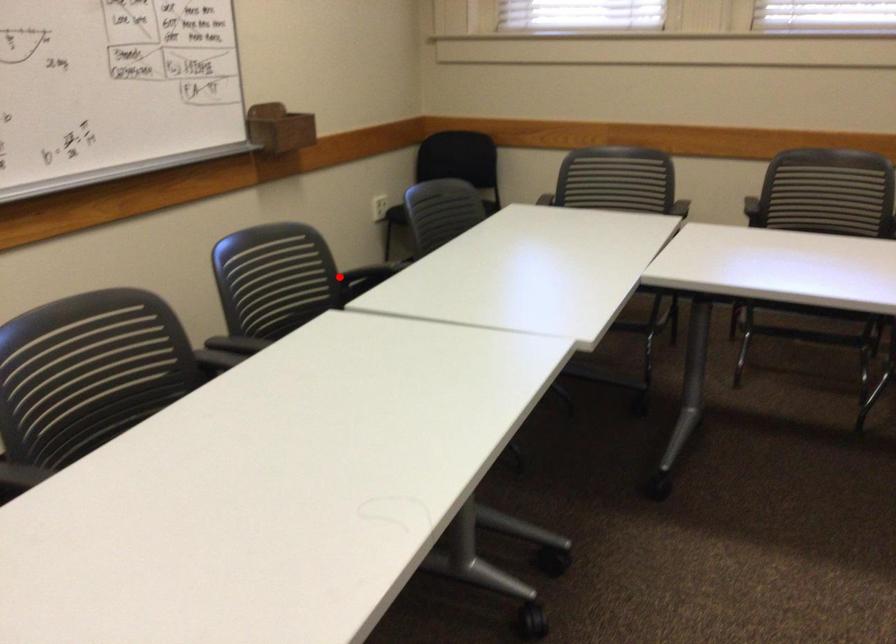
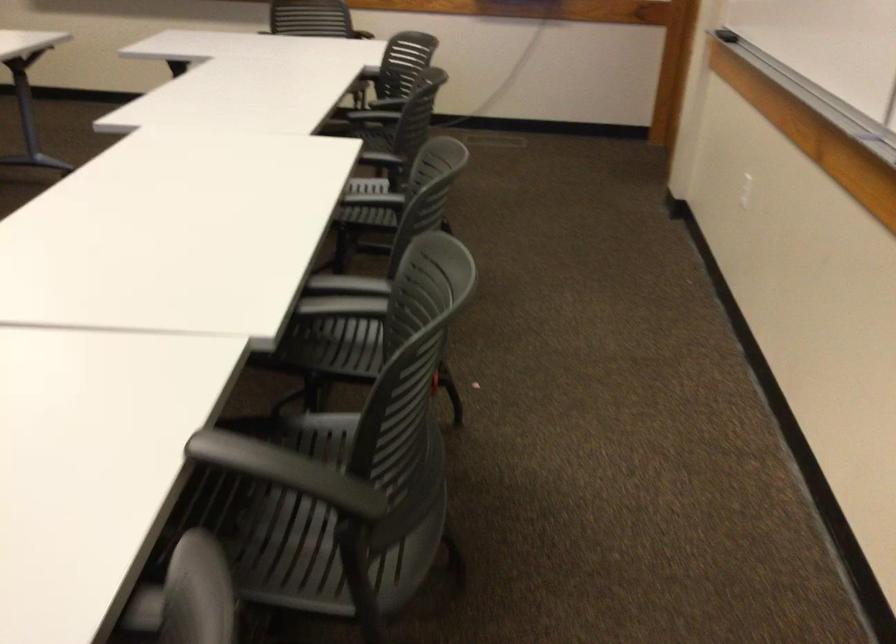
Where in the second image is the point corresponding to the highlighted location from the first image?

(286, 471)